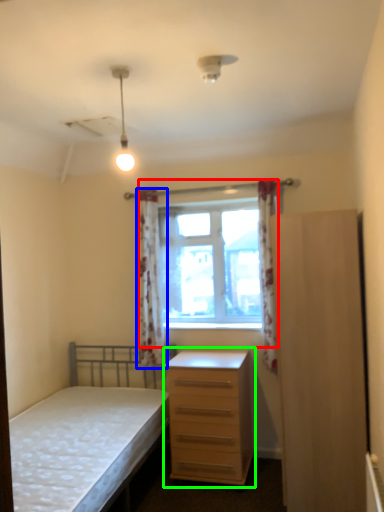
Question: Which is farther away from window (highlighted by a red box)? curtain (highlighted by a blue box) or chest of drawers (highlighted by a green box)?

Choices:
 (A) curtain
 (B) chest of drawers

Answer: (B)